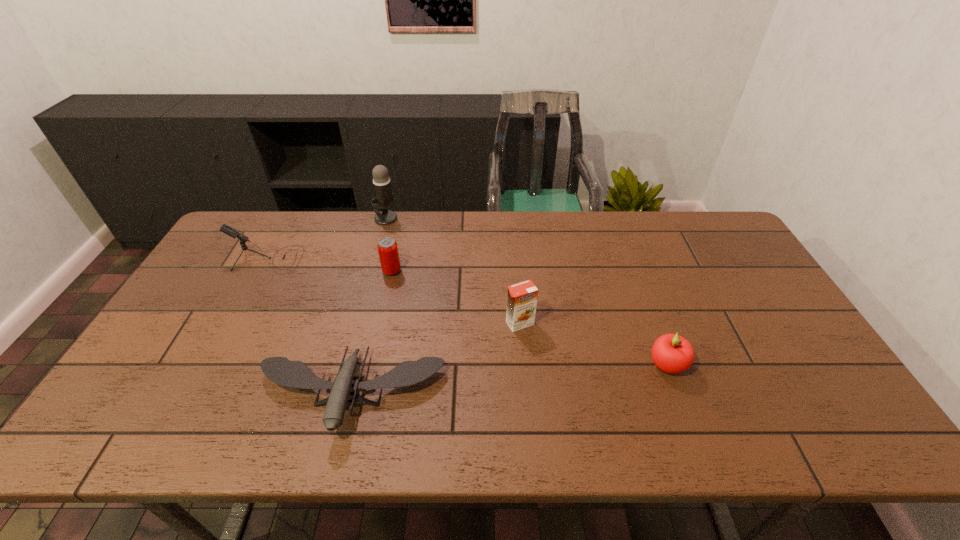
The height and width of the screenshot is (540, 960). Find the location of `vacant space positioned 0.260m on the front of the orange juice`. vacant space positioned 0.260m on the front of the orange juice is located at coordinates (528, 420).

The width and height of the screenshot is (960, 540). Find the location of `blank space located on the stand of the shorter microphone`. blank space located on the stand of the shorter microphone is located at coordinates (410, 259).

Locate an element on the screen. The width and height of the screenshot is (960, 540). vacant region located 0.370m on the left of the can is located at coordinates (264, 271).

Identify the location of free space located 0.150m on the front of the rightmost object. The height and width of the screenshot is (540, 960). (694, 438).

At what (x,y) coordinates should I click in order to perform the action: click on object at the near edge. Please return your answer as a coordinate pair (x, y). This screenshot has height=540, width=960. Looking at the image, I should click on (280, 370).

Find the location of a particular element. This screenshot has height=540, width=960. object that is positioned at the left edge is located at coordinates tap(232, 232).

Identify the location of object that is at the far left corner. This screenshot has width=960, height=540. (232, 232).

This screenshot has height=540, width=960. I want to click on free location at the far edge, so click(x=458, y=218).

In the image, there is a desktop. Identify the location of blank space at the near edge. (238, 440).

Locate an element on the screen. This screenshot has height=540, width=960. vacant area at the left edge is located at coordinates (192, 300).